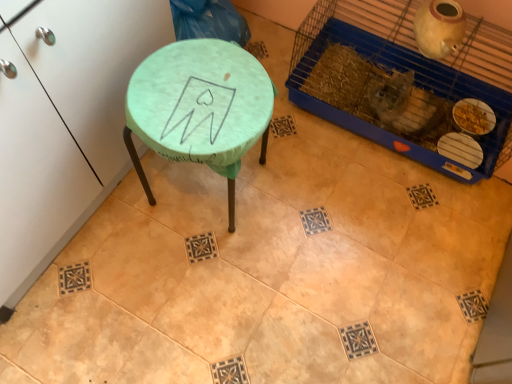
The image size is (512, 384). What are the coordinates of `vacant area that lies between blue plastic bird cage at upper right and matte green stool at center` in the screenshot? It's located at (326, 179).